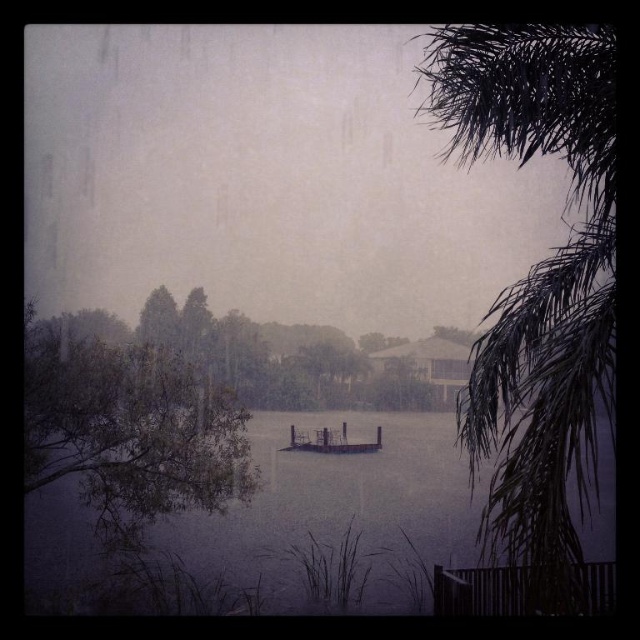
From the picture: You are standing at the lakeside and want to take a photo of the dark green leafy palm tree at right. If your camera has a maximum zoom range of 4 meters, will you be able to capture the tree clearly without moving closer?

The dark green leafy palm tree at right is 4.68 meters away from the camera. Since the camera can only zoom up to 4 meters, you won cannot capture the tree clearly without moving closer.

You are standing on the lakeside path and want to take a photo of both the green matte tree at left and the green leafy tree at center. Which tree should you position closer to the camera to ensure both are fully visible in the frame?

You should position the green matte tree at left closer to the camera because it has a lesser width than the green leafy tree at center, allowing both to fit within the frame without overlapping.